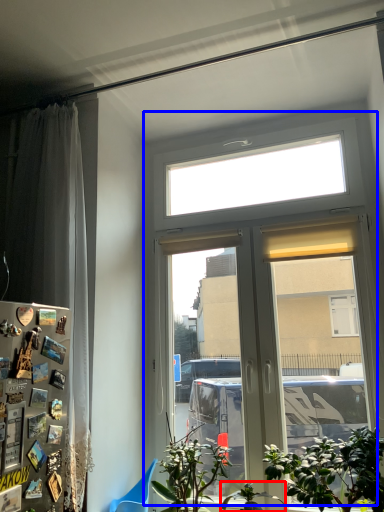
Question: Which point is further to the camera, houseplant (highlighted by a red box) or window (highlighted by a blue box)?

Choices:
 (A) houseplant
 (B) window

Answer: (B)